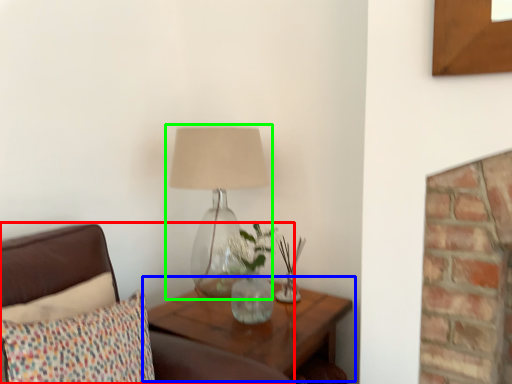
Question: Based on their relative distances, which object is farther from furniture (highlighted by a red box)? Choose from table (highlighted by a blue box) and lamp (highlighted by a green box).

Choices:
 (A) table
 (B) lamp

Answer: (B)